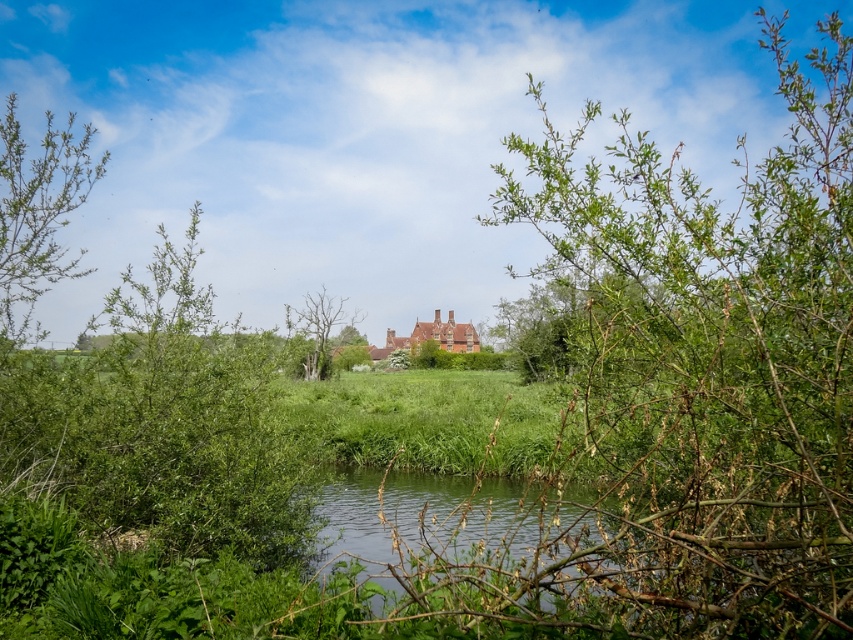
You are standing in the middle of the scene and want to walk towards the red brick building. Which object, the green leafy bush at left or the bare wood tree at center, would you pass by first?

The green leafy bush at left is positioned over the bare wood tree at center, so you would pass by the green leafy bush at left first as it is closer to your current position in the middle.

You are standing in the middle of the rural landscape scene. You see a green leafy bush at left and a bare wood tree at center. Which object is positioned to the right of the other?

The green leafy bush at left is positioned to the right of the bare wood tree at center.

You are standing in the middle of the rural landscape scene. There are two points in the image labeled as point 1 and point 2. Point 1 is at coordinates point (59,161) and point 2 is at coordinates point (317,300). Which point is closer to you?

Point (59,161) is closer to the viewer than point (317,300).